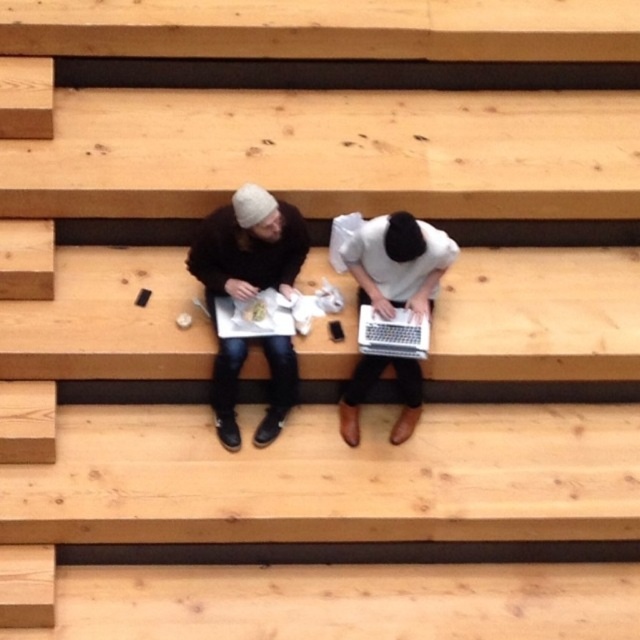
Question: Observing the image, what is the correct spatial positioning of matte black jacket at center in reference to silver metallic laptop at center?

Choices:
 (A) above
 (B) below

Answer: (A)

Question: Can you confirm if matte black jacket at center is wider than white matte laptop at center?

Choices:
 (A) yes
 (B) no

Answer: (A)

Question: Among these points, which one is farthest from the camera?

Choices:
 (A) (268, 348)
 (B) (444, 252)
 (C) (396, 314)

Answer: (C)

Question: Where is matte black jacket at center located in relation to white matte laptop at center in the image?

Choices:
 (A) below
 (B) above

Answer: (A)

Question: Among these points, which one is farthest from the camera?

Choices:
 (A) (396, 253)
 (B) (413, 332)

Answer: (B)

Question: Which of the following is the closest to the observer?

Choices:
 (A) (225, 348)
 (B) (404, 252)

Answer: (B)